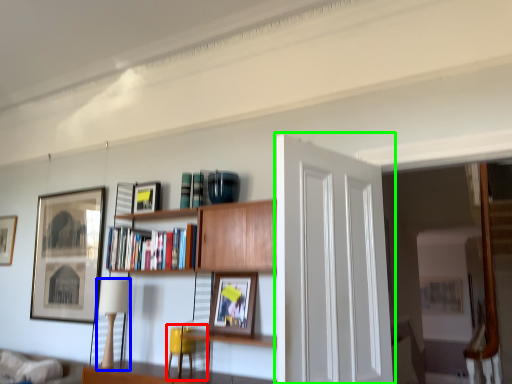
Question: Based on their relative distances, which object is farther from swivel chair (highlighted by a red box)? Choose from lamp (highlighted by a blue box) and door (highlighted by a green box).

Choices:
 (A) lamp
 (B) door

Answer: (B)